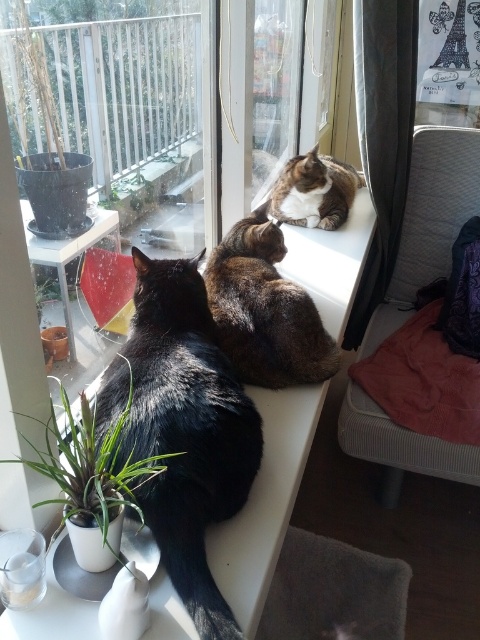
You are standing in front of the windowsill where the three cats are lounging. You want to place a small treat on the point closer to you between the two points labeled point (263, 381) and point (141, 200). Which point should you choose?

You should choose point (263, 381) because it is closer to the viewer than point (141, 200).

You are a cat owner trying to place a new cat bed on the windowsill. The bed requires 10 cm of space in front of it. Considering the black fur cat at left and the tabby fur cat at upper center, which cat is positioned closer to the edge of the windowsill?

The tabby fur cat at upper center is closer to the edge of the windowsill than the black fur cat at left.

In the scene shown: You are a cat owner trying to determine the best spot to place a new sunbathing mat for your cats. Given the current arrangement, which cat is located below the other between the brown fur cat at center and the tabby fur cat at upper center?

The brown fur cat at center is positioned under the tabby fur cat at upper center, so the brown fur cat at center is below the tabby fur cat at upper center.